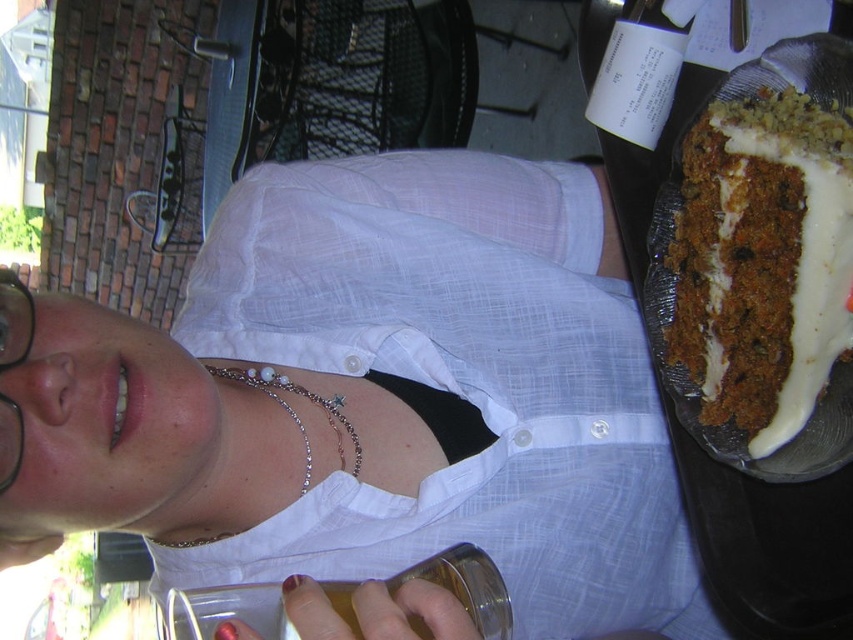
You are a photographer taking a picture of the carrot cake with cream cheese frosting at right. However, the white matte shirt at upper center is blocking your view. Can you move the shirt to capture the cake clearly?

The white matte shirt at upper center is in front of the carrot cake with cream cheese frosting at right, so moving the shirt would allow you to capture the cake clearly.

You are a waiter at a cafe and you see the carrot cake with cream cheese frosting at right and the black plastic glasses at upper left. Which item is taller?

The carrot cake with cream cheese frosting at right is taller than the black plastic glasses at upper left.

You are taking a photo of the person and want to focus on both the point at point (595, 420) and the point at point (16, 472). Which point should you adjust your focus to first to ensure both are in focus?

You should adjust your focus to point (16, 472) first because it is closer to the camera than point (595, 420). By focusing on the closer point, the farther point will also be in focus if the depth of field is sufficient.